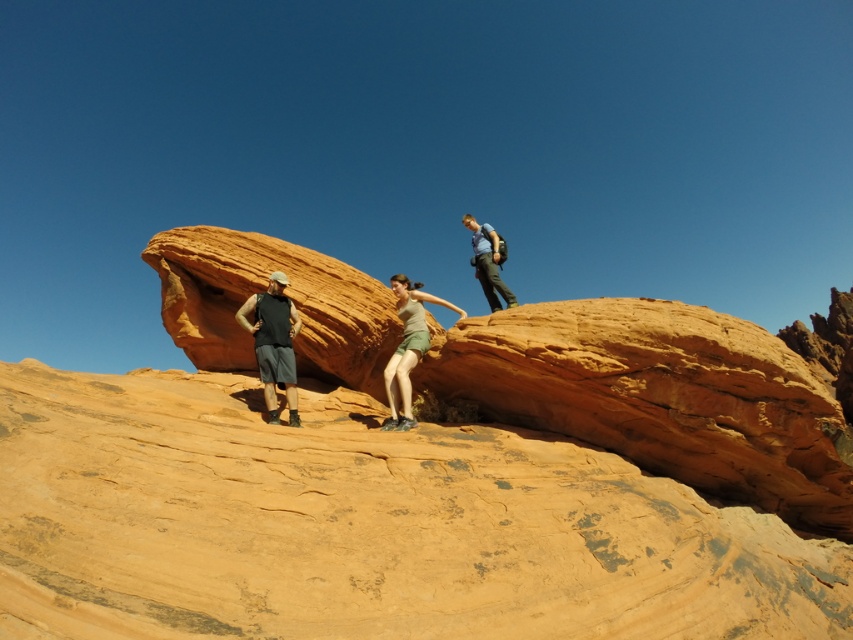
You are a photographer trying to capture the matte green shorts at center in the image. What are the coordinates where you should focus your camera?

The coordinates to focus on are point [407,348].

You are part of a hiking group in the desert. You notice two hikers wearing matte black tank top at center and matte green shorts at center. Which hiker is closer to you?

The matte black tank top at center is closer to you because it is in front of the matte green shorts at center.